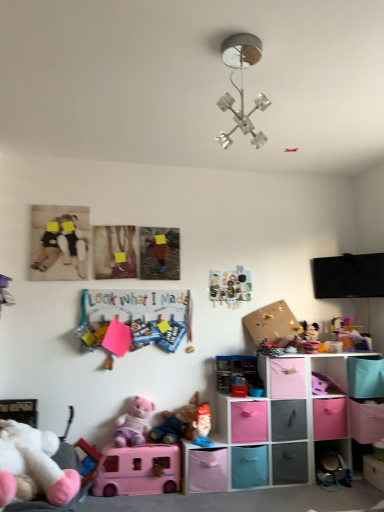
Question: Would you say translucent plastic toy at right, which is the 11th toy from left to right, contains pink fabric storage cube at lower right, which appears as the seventh shelf when viewed from the left?

Choices:
 (A) no
 (B) yes

Answer: (A)

Question: From a real-world perspective, is translucent plastic toy at right, which is the 11th toy from left to right, below pink fabric storage cube at lower right, which is counted as the 1th shelf, starting from the right?

Choices:
 (A) no
 (B) yes

Answer: (A)

Question: Can you confirm if translucent plastic toy at right, which is the 11th toy from left to right, is shorter than pink fabric storage cube at lower right, which is counted as the 1th shelf, starting from the right?

Choices:
 (A) yes
 (B) no

Answer: (B)

Question: From the image's perspective, is translucent plastic toy at right, which is the 11th toy from left to right, located above pink fabric storage cube at lower right, which appears as the seventh shelf when viewed from the left?

Choices:
 (A) no
 (B) yes

Answer: (B)

Question: Considering the relative sizes of translucent plastic toy at right, which is the 11th toy from left to right, and pink fabric storage cube at lower right, which is counted as the 1th shelf, starting from the right, in the image provided, is translucent plastic toy at right, which is the 11th toy from left to right, smaller than pink fabric storage cube at lower right, which is counted as the 1th shelf, starting from the right,?

Choices:
 (A) no
 (B) yes

Answer: (A)

Question: Does translucent plastic toy at right, which is the 11th toy from left to right, have a greater width compared to pink fabric storage cube at lower right, which is counted as the 1th shelf, starting from the right?

Choices:
 (A) no
 (B) yes

Answer: (A)

Question: Are black matte teddy bear at left, which is counted as the eleventh toy, starting from the right, and plush fabric toy at lower center, positioned as the sixth toy in left-to-right order, far apart?

Choices:
 (A) yes
 (B) no

Answer: (A)

Question: Is black matte teddy bear at left, which is counted as the eleventh toy, starting from the right, positioned in front of plush fabric toy at lower center, positioned as the sixth toy in left-to-right order?

Choices:
 (A) yes
 (B) no

Answer: (B)

Question: Is black matte teddy bear at left, which is counted as the eleventh toy, starting from the right, bigger than plush fabric toy at lower center, positioned as the sixth toy in left-to-right order?

Choices:
 (A) no
 (B) yes

Answer: (A)

Question: Is black matte teddy bear at left, which is counted as the eleventh toy, starting from the right, looking in the opposite direction of plush fabric toy at lower center, positioned as the sixth toy in left-to-right order?

Choices:
 (A) no
 (B) yes

Answer: (A)

Question: Can you confirm if black matte teddy bear at left, which is counted as the eleventh toy, starting from the right, is shorter than plush fabric toy at lower center, positioned as the sixth toy in left-to-right order?

Choices:
 (A) yes
 (B) no

Answer: (B)

Question: Is black matte teddy bear at left, the 1th toy from the left, directly adjacent to plush fabric toy at lower center, positioned as the sixth toy in left-to-right order?

Choices:
 (A) yes
 (B) no

Answer: (B)

Question: Considering the relative sizes of pink fabric storage bin at lower center, arranged as the 5th shelf when viewed from the right, and plush fabric toy at lower center, positioned as the sixth toy in left-to-right order, in the image provided, is pink fabric storage bin at lower center, arranged as the 5th shelf when viewed from the right, thinner than plush fabric toy at lower center, positioned as the sixth toy in left-to-right order,?

Choices:
 (A) yes
 (B) no

Answer: (B)